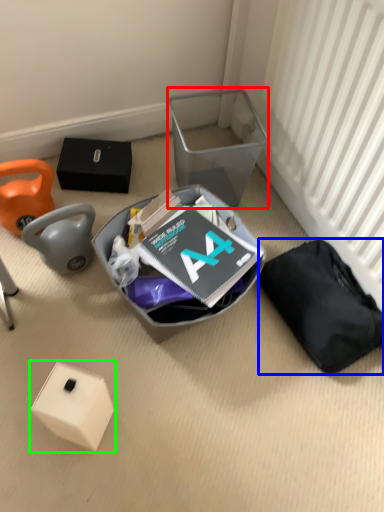
Question: Which is nearer to the shoe box (highlighted by a red box)? waste (highlighted by a blue box) or box (highlighted by a green box).

Choices:
 (A) waste
 (B) box

Answer: (A)